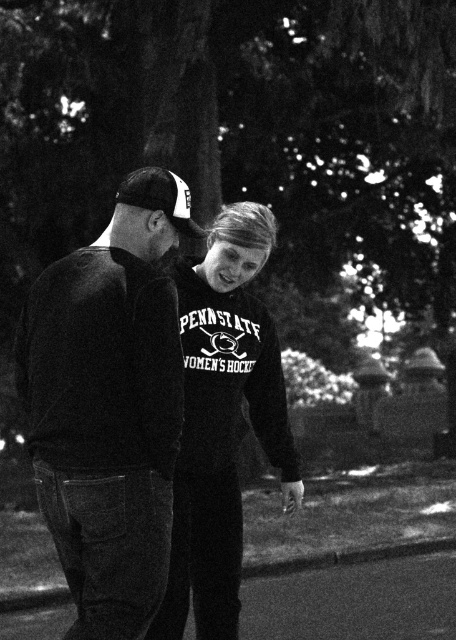
Question: Is dark gray sweater at center to the left of velvet black sweatshirt at center from the viewer's perspective?

Choices:
 (A) no
 (B) yes

Answer: (B)

Question: Does dark gray sweater at center appear over velvet black sweatshirt at center?

Choices:
 (A) no
 (B) yes

Answer: (B)

Question: Can you confirm if dark gray sweater at center is positioned to the right of velvet black sweatshirt at center?

Choices:
 (A) yes
 (B) no

Answer: (B)

Question: Which of the following is the farthest from the observer?

Choices:
 (A) (26, 408)
 (B) (202, 612)

Answer: (B)